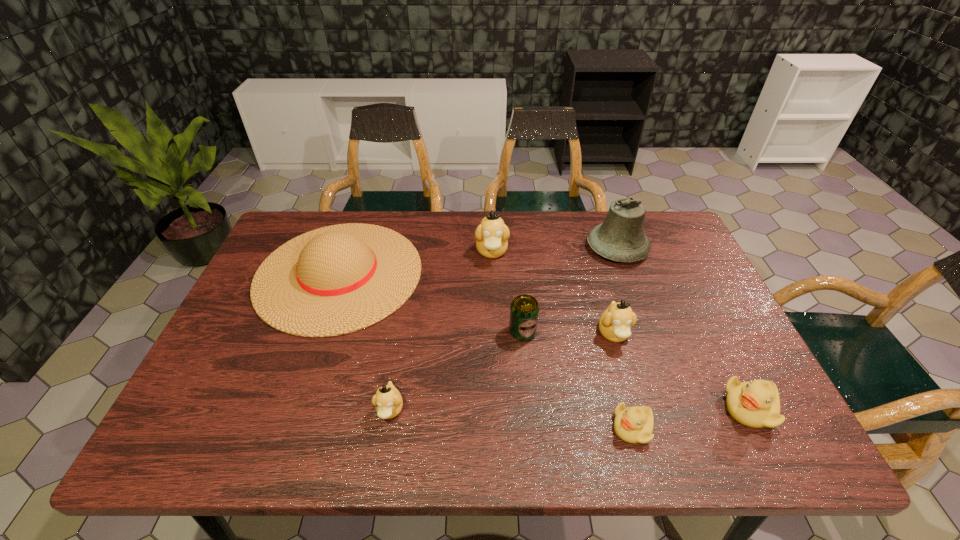
Identify the location of blank space located 0.280m on the front-facing side of the right yellow duckling. (597, 408).

At what (x,y) coordinates should I click in order to perform the action: click on vacant area located 0.170m on the front-facing side of the left yellow duckling. Please return your answer as a coordinate pair (x, y). The width and height of the screenshot is (960, 540). Looking at the image, I should click on (533, 428).

Image resolution: width=960 pixels, height=540 pixels. Identify the location of vacant space located 0.260m on the front-facing side of the left yellow duckling. (491, 428).

You are a GUI agent. You are given a task and a screenshot of the screen. Output one action in this format:
    pyautogui.click(x=<x>, y=<y>)
    Task: Click on the free space located on the front-facing side of the left yellow duckling
    The height and width of the screenshot is (540, 960).
    Given the screenshot: What is the action you would take?
    pyautogui.click(x=518, y=428)

Where is `bell that is positioned at the far edge`? This screenshot has width=960, height=540. bell that is positioned at the far edge is located at coordinates (620, 238).

Identify the location of duckling that is at the far edge. tap(492, 234).

Identify the location of bonnet positioned at the far edge. (338, 279).

Identify the location of object situated at the left edge. The height and width of the screenshot is (540, 960). coord(338,279).

Locate an element on the screen. This screenshot has width=960, height=540. bell located at the right edge is located at coordinates (620, 238).

The width and height of the screenshot is (960, 540). What are the coordinates of `duckling at the right edge` in the screenshot? It's located at click(756, 404).